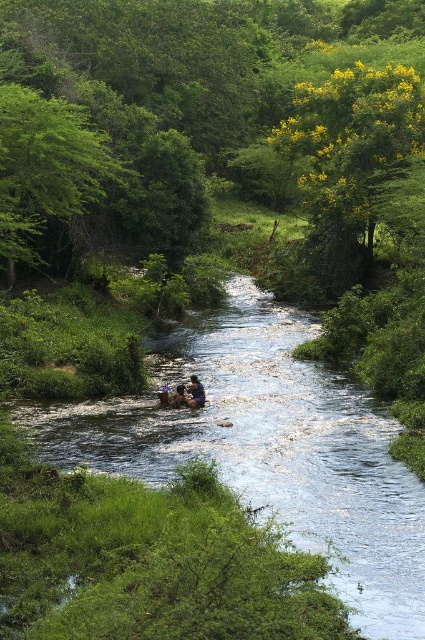
You are standing at the edge of the river and want to find the best spot to take a photo that includes both the green leafy tree at center and the green leafy tree at upper left. Which tree should you position closer to the camera to include both in the frame?

To include both the green leafy tree at center and the green leafy tree at upper left in the frame, you should position the green leafy tree at upper left closer to the camera since it is located below the green leafy tree at center, allowing both to be captured within the photo.

You are planning to cross the river using the brown leather boat at center. The clear water stream at center is wider than the boat. Can the boat safely navigate the stream without touching the sides?

The clear water stream at center is wider than the brown leather boat at center, so the boat can safely navigate the stream without touching the sides.